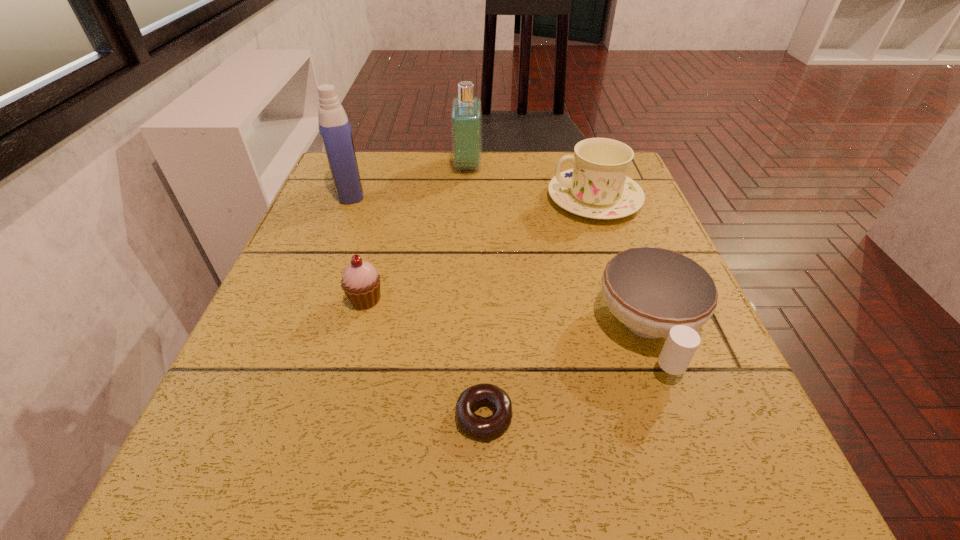
Locate an element on the screen. empty location between the second tallest object and the nearer chinaware is located at coordinates (559, 248).

Where is `vacant space in between the cupcake and the nearest object`? This screenshot has width=960, height=540. vacant space in between the cupcake and the nearest object is located at coordinates (424, 358).

Find the location of a particular element. The height and width of the screenshot is (540, 960). vacant space in between the farther chinaware and the second object from left to right is located at coordinates point(480,249).

Locate an element on the screen. unoccupied area between the leftmost object and the shorter chinaware is located at coordinates (499, 261).

The width and height of the screenshot is (960, 540). What are the coordinates of `free space between the cupcake and the taller chinaware` in the screenshot? It's located at (480, 249).

The height and width of the screenshot is (540, 960). In order to click on vacant area between the doughnut and the taller chinaware in this screenshot , I will do `click(540, 308)`.

At what (x,y) coordinates should I click in order to perform the action: click on free space between the tallest object and the taller chinaware. Please return your answer as a coordinate pair (x, y). The width and height of the screenshot is (960, 540). Looking at the image, I should click on (471, 195).

At what (x,y) coordinates should I click in order to perform the action: click on free area in between the nearest object and the farther chinaware. Please return your answer as a coordinate pair (x, y). Image resolution: width=960 pixels, height=540 pixels. Looking at the image, I should click on (540, 308).

Select which object is the fourth closest to the shortest object. Please provide its 2D coordinates. Your answer should be formatted as a tuple, i.e. [(x, y)], where the tuple contains the x and y coordinates of a point satisfying the conditions above.

[(334, 126)]

Find the location of a particular element. This screenshot has height=540, width=960. object that ranks as the third closest to the cupcake is located at coordinates (655, 292).